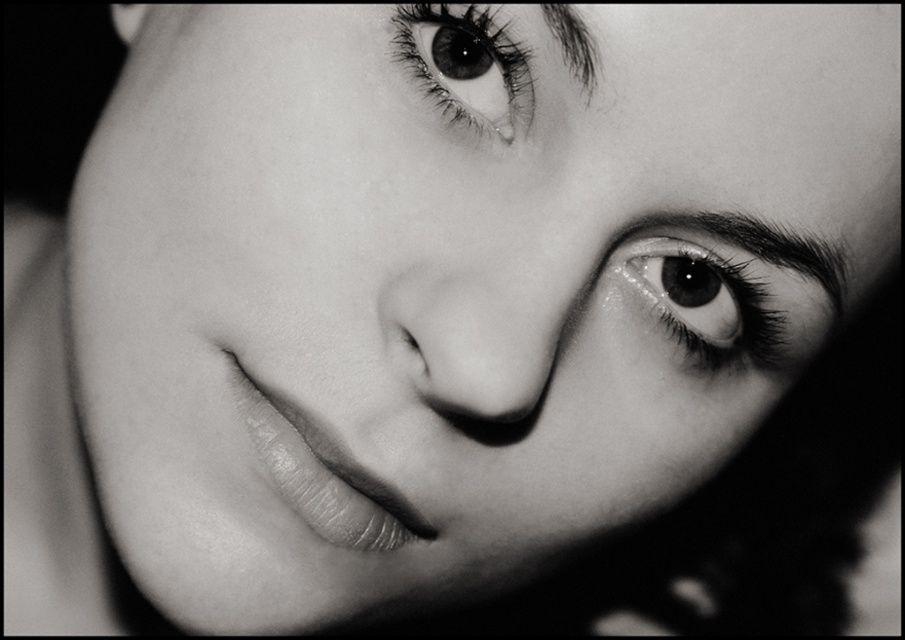
Question: Which point is closer to the camera taking this photo?

Choices:
 (A) (813, 260)
 (B) (773, 355)

Answer: (A)

Question: Can you confirm if smooth skin eye at upper center is wider than black smooth eyebrow at upper right?

Choices:
 (A) yes
 (B) no

Answer: (B)

Question: Is black smooth eyebrow at upper right further to the viewer compared to dark hair at upper right?

Choices:
 (A) no
 (B) yes

Answer: (B)

Question: Among these objects, which one is nearest to the camera?

Choices:
 (A) dark hair at upper right
 (B) smooth skin eye at upper center
 (C) black smooth eyebrow at upper right
 (D) glossy black eye at upper right

Answer: (A)

Question: Which of the following is the closest to the observer?

Choices:
 (A) smooth skin eye at upper center
 (B) black smooth eyebrow at upper right

Answer: (A)

Question: Is glossy black eye at upper right wider than dark hair at upper right?

Choices:
 (A) no
 (B) yes

Answer: (B)